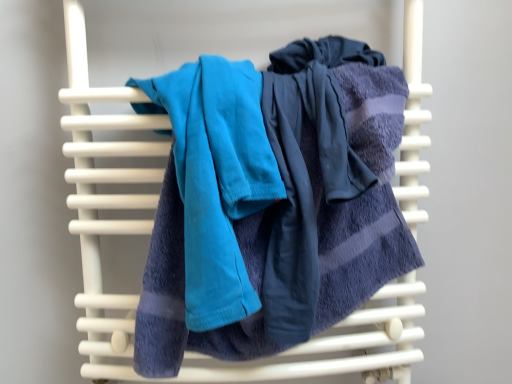
Question: From a real-world perspective, relative to teal fabric towel at center, acting as the 2th towel starting from the right, is soft blue towel at center, arranged as the first towel when viewed from the right, vertically above or below?

Choices:
 (A) above
 (B) below

Answer: (B)

Question: Is soft blue towel at center, arranged as the first towel when viewed from the right, bigger or smaller than teal fabric towel at center, acting as the 2th towel starting from the right?

Choices:
 (A) big
 (B) small

Answer: (A)

Question: Based on their positions, is soft blue towel at center, arranged as the first towel when viewed from the right, located to the left or right of teal fabric towel at center, the first towel in the left-to-right sequence?

Choices:
 (A) left
 (B) right

Answer: (B)

Question: From the image's perspective, is teal fabric towel at center, the first towel in the left-to-right sequence, positioned above or below soft blue towel at center, arranged as the first towel when viewed from the right?

Choices:
 (A) above
 (B) below

Answer: (A)

Question: From a real-world perspective, is teal fabric towel at center, the first towel in the left-to-right sequence, physically located above or below soft blue towel at center, which ranks as the 2th towel in left-to-right order?

Choices:
 (A) above
 (B) below

Answer: (A)

Question: Is teal fabric towel at center, acting as the 2th towel starting from the right, taller or shorter than soft blue towel at center, arranged as the first towel when viewed from the right?

Choices:
 (A) tall
 (B) short

Answer: (B)

Question: In terms of width, does teal fabric towel at center, the first towel in the left-to-right sequence, look wider or thinner when compared to soft blue towel at center, which ranks as the 2th towel in left-to-right order?

Choices:
 (A) thin
 (B) wide

Answer: (A)